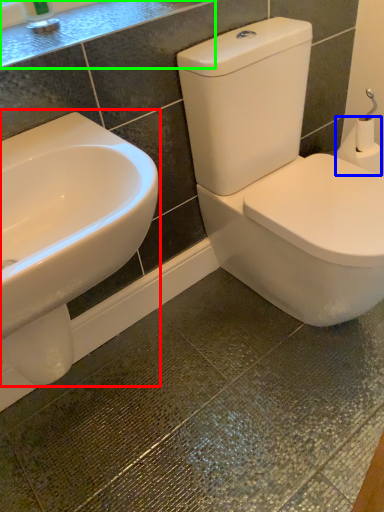
Question: Which object is positioned farthest from sink (highlighted by a red box)? Select from toilet paper (highlighted by a blue box) and counter top (highlighted by a green box).

Choices:
 (A) toilet paper
 (B) counter top

Answer: (A)